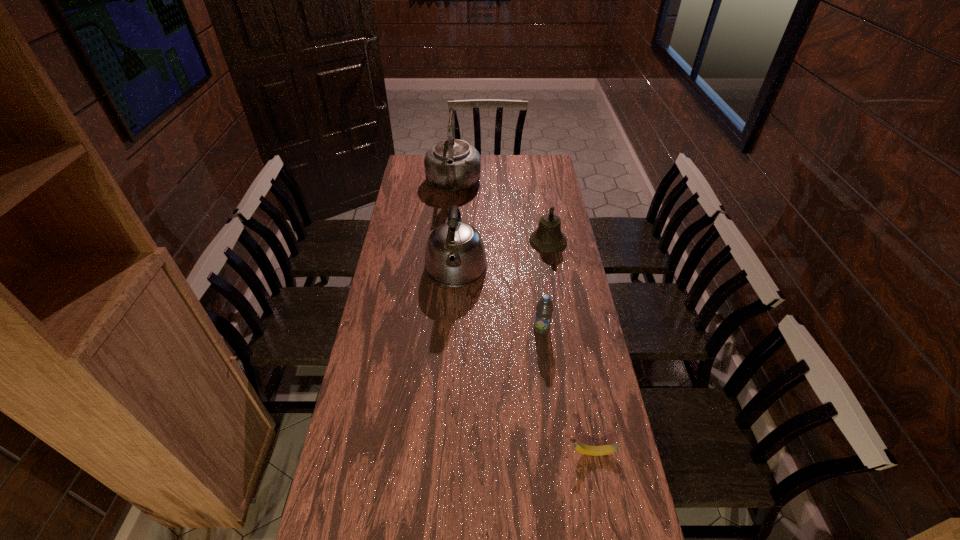
You are a GUI agent. You are given a task and a screenshot of the screen. Output one action in this format:
    pyautogui.click(x=<x>, y=<y>)
    Task: Click on the object that is at the far left corner
    The width and height of the screenshot is (960, 540).
    Given the screenshot: What is the action you would take?
    pyautogui.click(x=451, y=165)

The width and height of the screenshot is (960, 540). What are the coordinates of `vacant space at the far edge` in the screenshot? It's located at (489, 154).

This screenshot has width=960, height=540. Find the location of `vacant space at the left edge of the desktop`. vacant space at the left edge of the desktop is located at coordinates (390, 363).

Identify the location of vacant space at the far left corner of the desktop. The image size is (960, 540). (414, 173).

The width and height of the screenshot is (960, 540). I want to click on blank region between the taller kettle and the second nearest object, so click(x=497, y=257).

This screenshot has height=540, width=960. Identify the location of free space between the water bottle and the bell. (545, 285).

In order to click on free spot between the banana and the fourth shortest object in this screenshot , I will do `click(523, 361)`.

Find the location of `free spot between the bell and the farthest object`. free spot between the bell and the farthest object is located at coordinates (500, 213).

The width and height of the screenshot is (960, 540). Find the location of `free space between the banana and the water bottle`. free space between the banana and the water bottle is located at coordinates (566, 391).

Find the location of a particular element. The image size is (960, 540). vacant space that is in between the bell and the fourth shortest object is located at coordinates (502, 255).